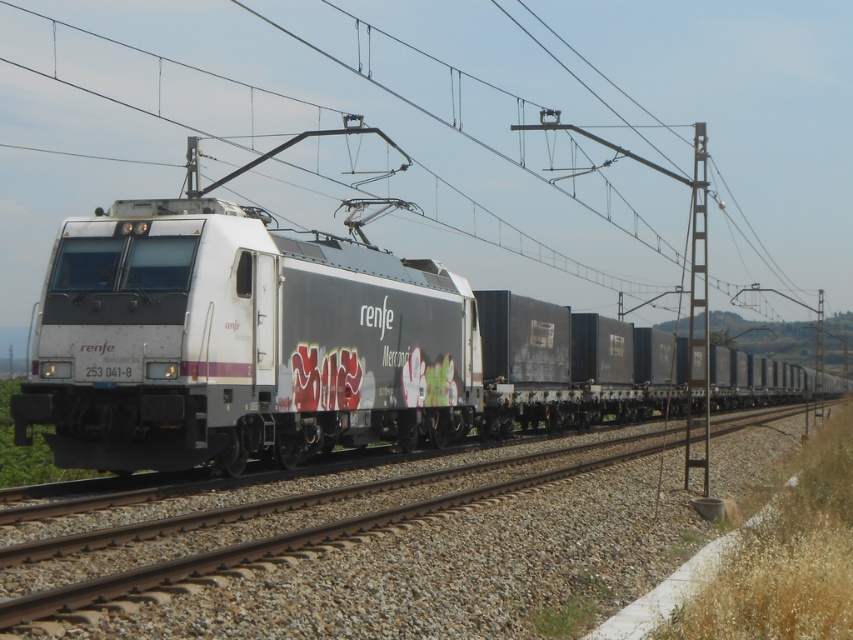
Question: Does metallic wire at center appear under metallic gray pole at right?

Choices:
 (A) yes
 (B) no

Answer: (A)

Question: Is metallic wire at center to the right of metal train tracks at center from the viewer's perspective?

Choices:
 (A) no
 (B) yes

Answer: (A)

Question: Does white matte train at center appear on the right side of metallic gray pole at right?

Choices:
 (A) no
 (B) yes

Answer: (A)

Question: Among these objects, which one is nearest to the camera?

Choices:
 (A) metallic wire at center
 (B) metal train tracks at center
 (C) white matte train at center

Answer: (B)

Question: Among these points, which one is nearest to the camera?

Choices:
 (A) (28, 400)
 (B) (392, 220)

Answer: (A)

Question: Based on their relative distances, which object is nearer to the white matte train at center?

Choices:
 (A) metal train tracks at center
 (B) metallic wire at center
 (C) metallic gray pole at right

Answer: (C)